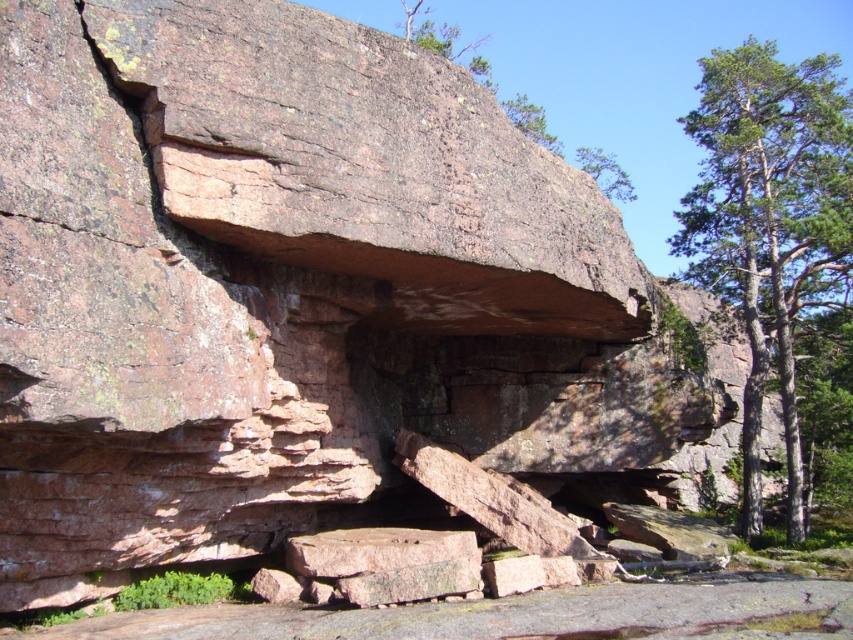
Consider the image. You are planning to set up a campsite between the green textured tree at right and the green leafy tree at upper center. The recommended safe distance between tents is 15 meters. Can you place your tent between them without violating the safety guidelines?

The distance between the green textured tree at right and the green leafy tree at upper center is 17.71 meters, which exceeds the recommended 15 meters. Therefore, you can place your tent between them while adhering to the safety guidelines.

You are a hiker looking for shade. You see a green textured tree at right and a green leafy tree at upper center. Which tree is closer to the ground?

The green textured tree at right is closer to the ground because it is below the green leafy tree at upper center.